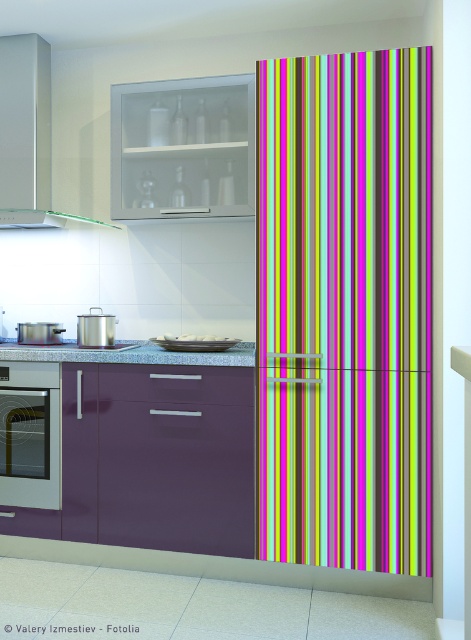
From the picture: You are a chef preparing breakfast and notice the granite countertop at center and the satin silver pot at center in the kitchen. Which object is positioned to the right of the other?

The granite countertop at center is to the right of the satin silver pot at center.